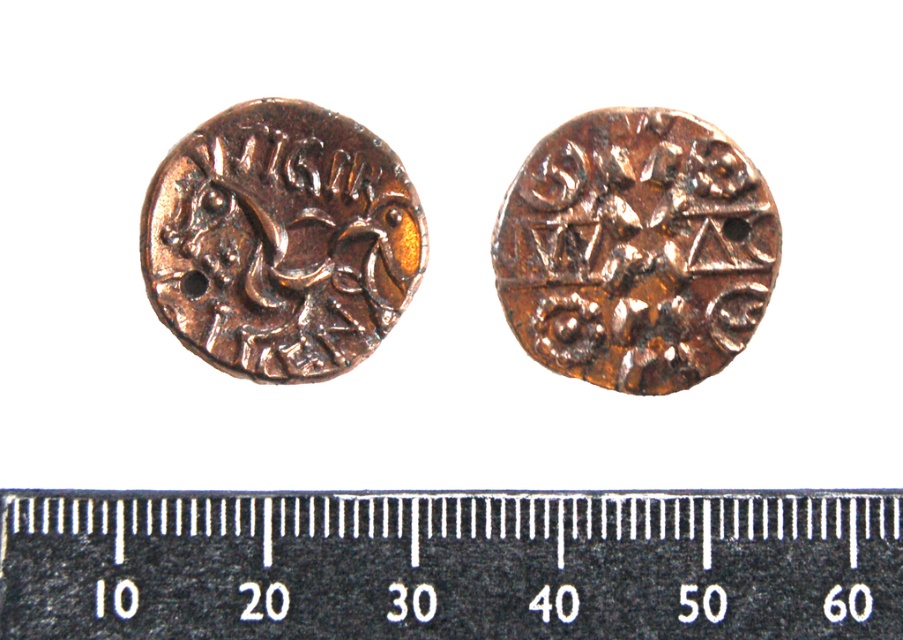
You are an archaeologist examining the image of two ancient coins. You need to measure the diameter of the rusty copper coin at center using the black metal ruler at bottom. Can you confirm if the ruler is placed correctly underneath the coin to take an accurate measurement?

The black metal ruler at bottom is positioned under the rusty copper coin at center, so yes, the ruler is placed correctly underneath the coin to take an accurate measurement.